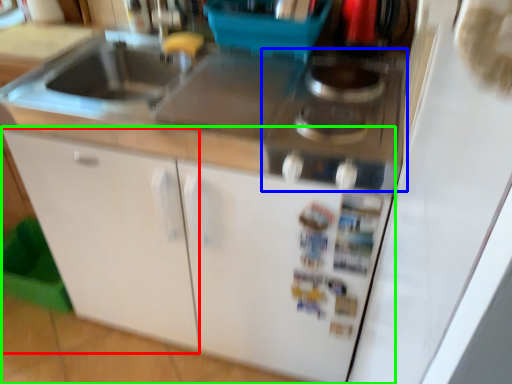
Question: Which object is positioned farthest from cabinetry (highlighted by a red box)? Select from gas stove (highlighted by a blue box) and cabinetry (highlighted by a green box).

Choices:
 (A) gas stove
 (B) cabinetry

Answer: (A)